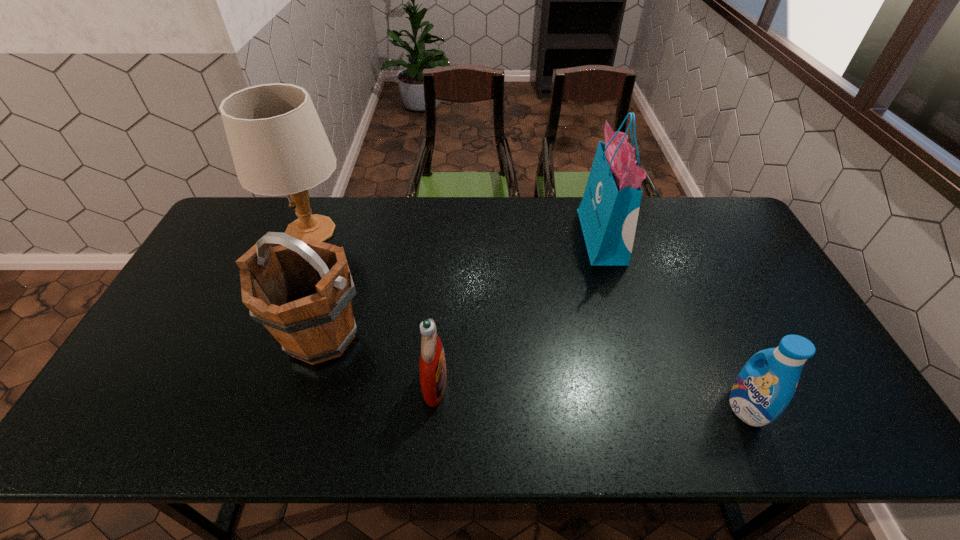
The image size is (960, 540). I want to click on vacant position in the image that satisfies the following two spatial constraints: 1. on the back side of the bucket; 2. on the left side of the fourth object from left to right, so click(x=352, y=237).